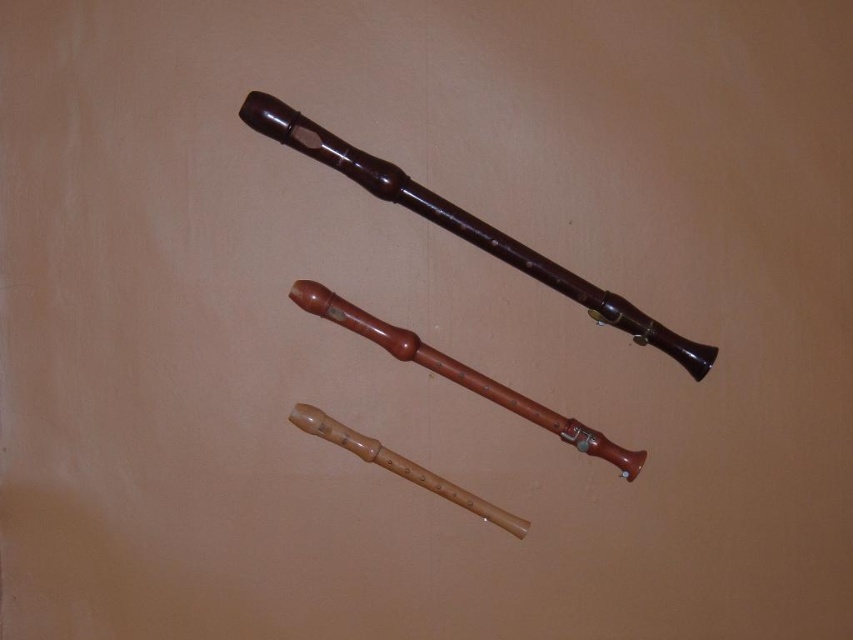
Question: Does light brown wood flute at center come in front of natural wood flute at center?

Choices:
 (A) yes
 (B) no

Answer: (A)

Question: Does light brown wood flute at center appear on the left side of natural wood flute at center?

Choices:
 (A) yes
 (B) no

Answer: (B)

Question: Which of the following is the closest to the observer?

Choices:
 (A) (370, 448)
 (B) (627, 470)

Answer: (A)

Question: Does light brown wood flute at center appear over natural wood flute at center?

Choices:
 (A) yes
 (B) no

Answer: (A)

Question: Which of the following is the closest to the observer?

Choices:
 (A) matte brown flute at upper center
 (B) natural wood flute at center
 (C) light brown wood flute at center

Answer: (A)

Question: Which of the following is the closest to the observer?

Choices:
 (A) light brown wood flute at center
 (B) natural wood flute at center
 (C) matte brown flute at upper center

Answer: (C)